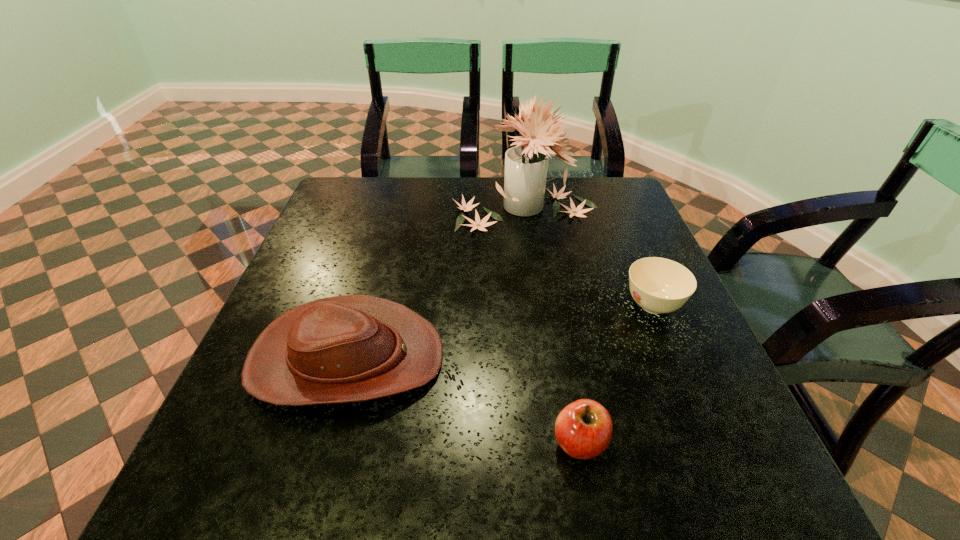
Locate an element on the screen. object situated at the near edge is located at coordinates (583, 429).

Locate an element on the screen. object that is at the left edge is located at coordinates (352, 348).

The image size is (960, 540). What are the coordinates of `bouquet that is at the right edge` in the screenshot? It's located at (526, 165).

I want to click on sugar bowl that is at the right edge, so click(x=658, y=285).

This screenshot has width=960, height=540. Find the location of `object present at the far right corner`. object present at the far right corner is located at coordinates (526, 165).

In the image, there is a desktop. At what (x,y) coordinates should I click in order to perform the action: click on vacant space at the far edge. Please return your answer as a coordinate pair (x, y). The width and height of the screenshot is (960, 540). Looking at the image, I should click on (444, 212).

Locate an element on the screen. free spot at the near edge of the desktop is located at coordinates (413, 480).

Locate an element on the screen. This screenshot has height=540, width=960. free space at the left edge of the desktop is located at coordinates (317, 230).

At what (x,y) coordinates should I click in order to perform the action: click on free spot at the right edge of the desktop. Please return your answer as a coordinate pair (x, y). The width and height of the screenshot is (960, 540). Looking at the image, I should click on (679, 323).

Image resolution: width=960 pixels, height=540 pixels. Identify the location of free space at the far left corner of the desktop. (388, 178).